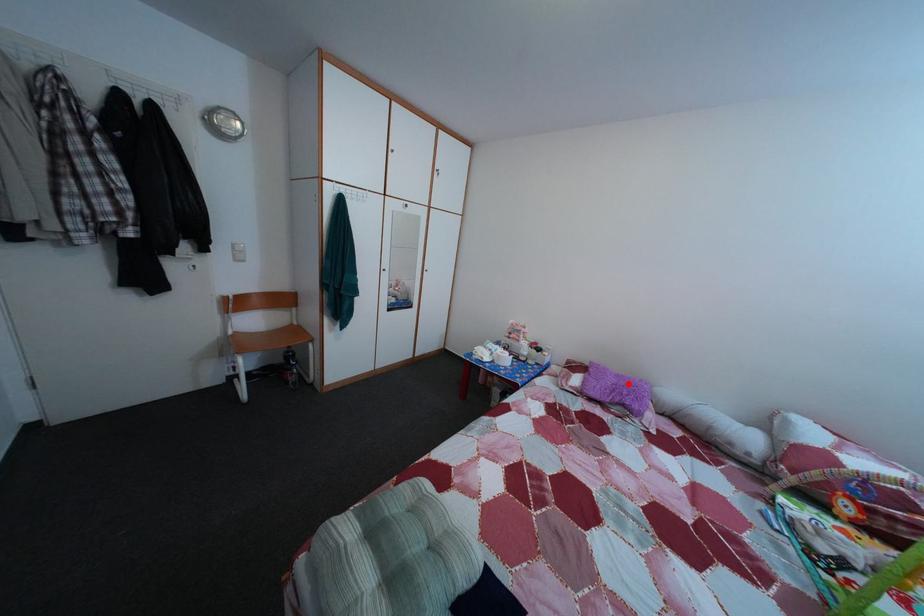
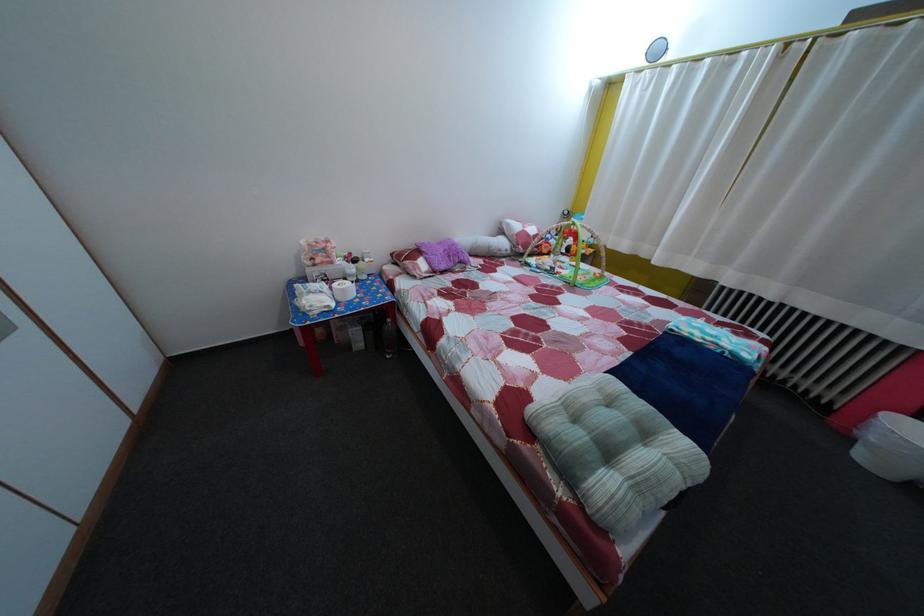
Question: I am providing you with two images of the same scene from different viewpoints. In image1, a red point is highlighted. Considering the same 3D point in image2, which of the following is correct?

Choices:
 (A) It is closer
 (B) It is farther

Answer: (A)